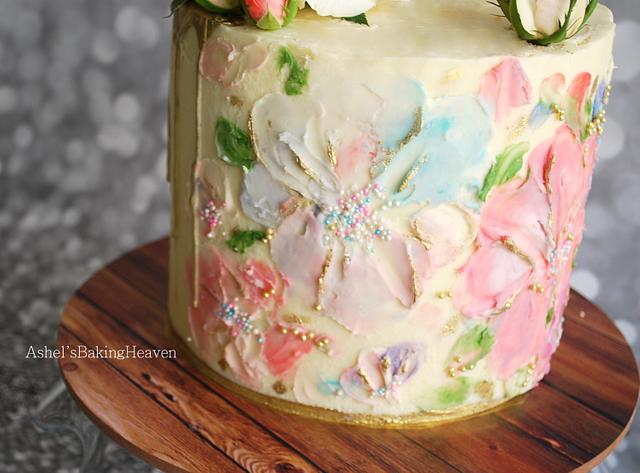
In order to click on wood stand in this screenshot , I will do `click(297, 441)`.